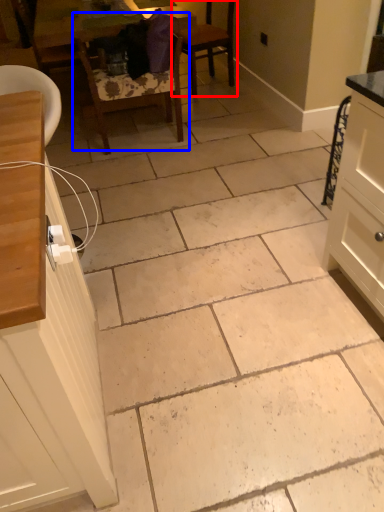
Question: Among these objects, which one is nearest to the camera, chair (highlighted by a red box) or chair (highlighted by a blue box)?

Choices:
 (A) chair
 (B) chair

Answer: (B)